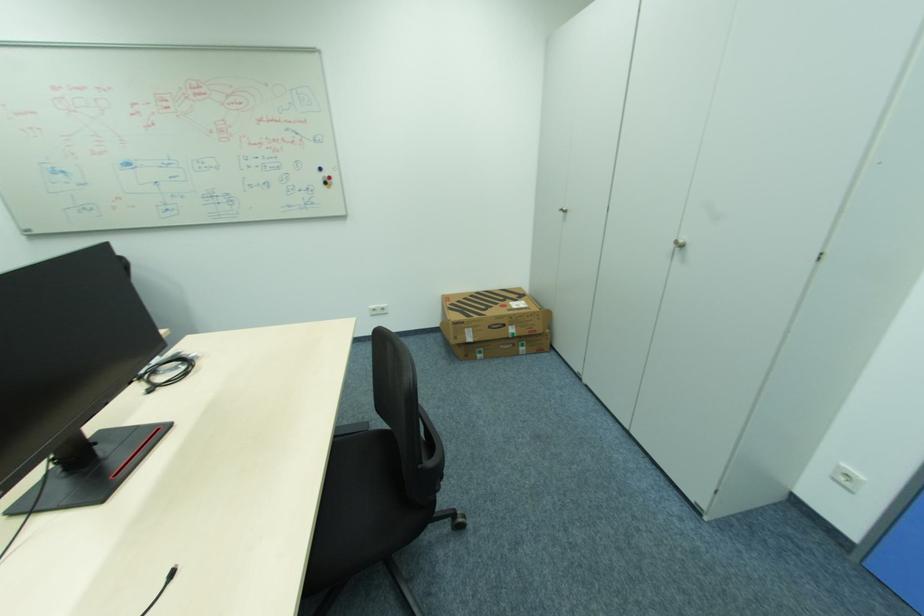
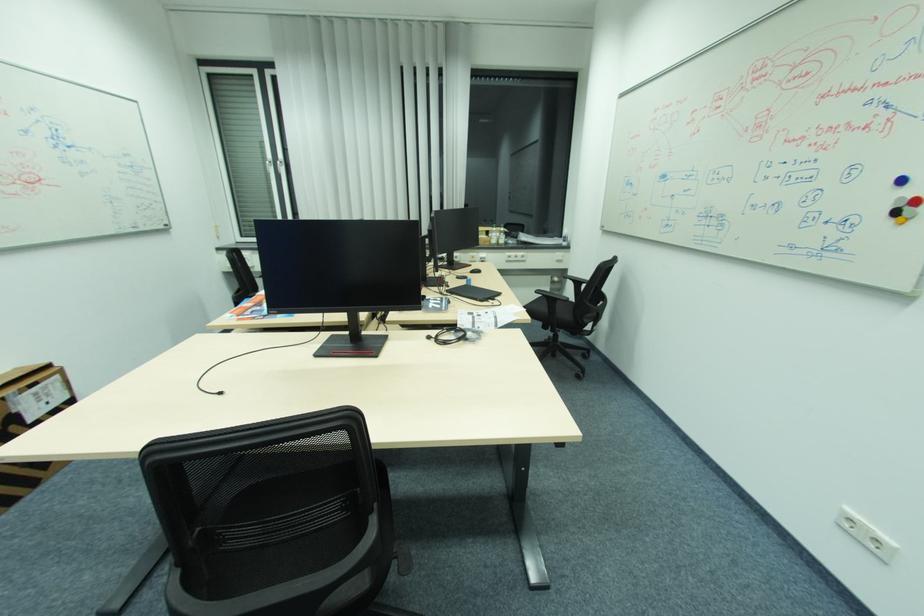
The point at (156, 390) is marked in the first image. Where is the corresponding point in the second image?

(434, 338)